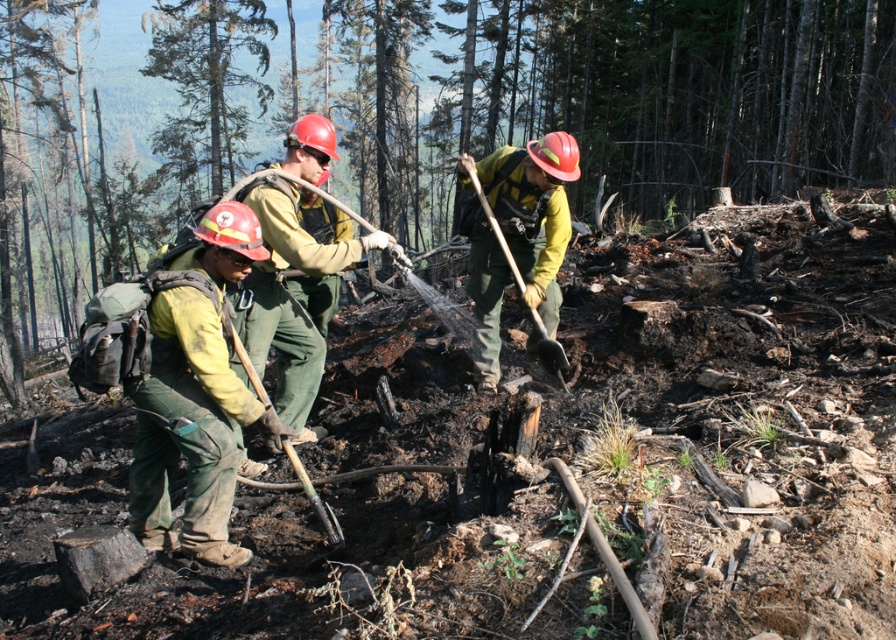
Can you confirm if green canvas pants at center is positioned to the left of green wooden shovel at lower center?

Indeed, green canvas pants at center is positioned on the left side of green wooden shovel at lower center.

Is point (238, 406) positioned behind point (238, 340)?

No, (238, 406) is closer to viewer.

You are a GUI agent. You are given a task and a screenshot of the screen. Output one action in this format:
    pyautogui.click(x=<x>, y=<y>)
    Task: Click on the green canvas pants at center
    
    Given the screenshot: What is the action you would take?
    pyautogui.click(x=196, y=396)

Does point (317, 380) come closer to viewer compared to point (484, 236)?

That is True.

Consider the image. Between matte green uniform at center and wooden shovel at center, which one is positioned higher?

Positioned higher is wooden shovel at center.

Is point (298, 259) behind point (541, 339)?

No, (298, 259) is closer to viewer.

Locate an element on the screen. matte green uniform at center is located at coordinates (289, 296).

What do you see at coordinates (289, 296) in the screenshot?
I see `matte green uniform at center` at bounding box center [289, 296].

Is point (265, 310) more distant than point (342, 536)?

Yes, it is.

Image resolution: width=896 pixels, height=640 pixels. In order to click on matte green uniform at center in this screenshot , I will do `click(289, 296)`.